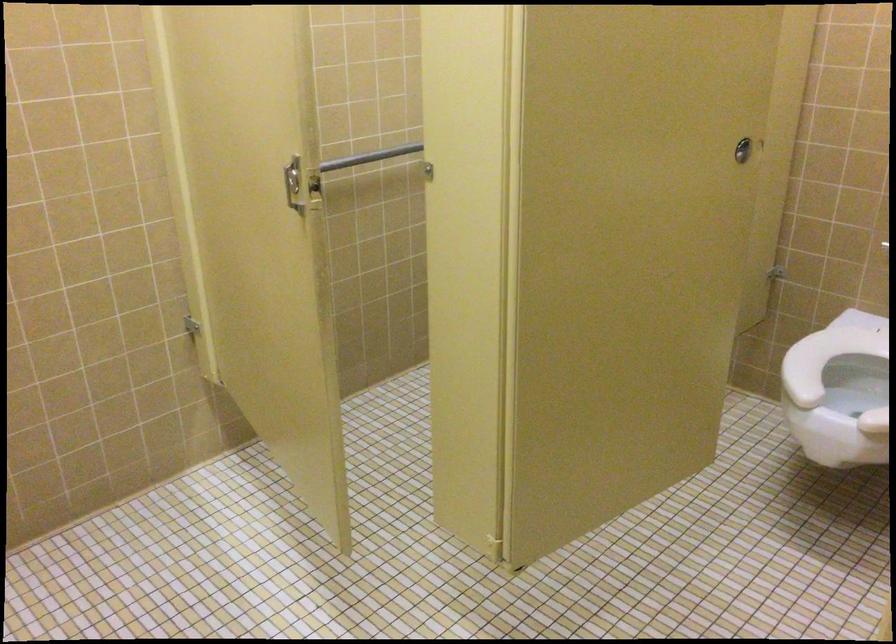
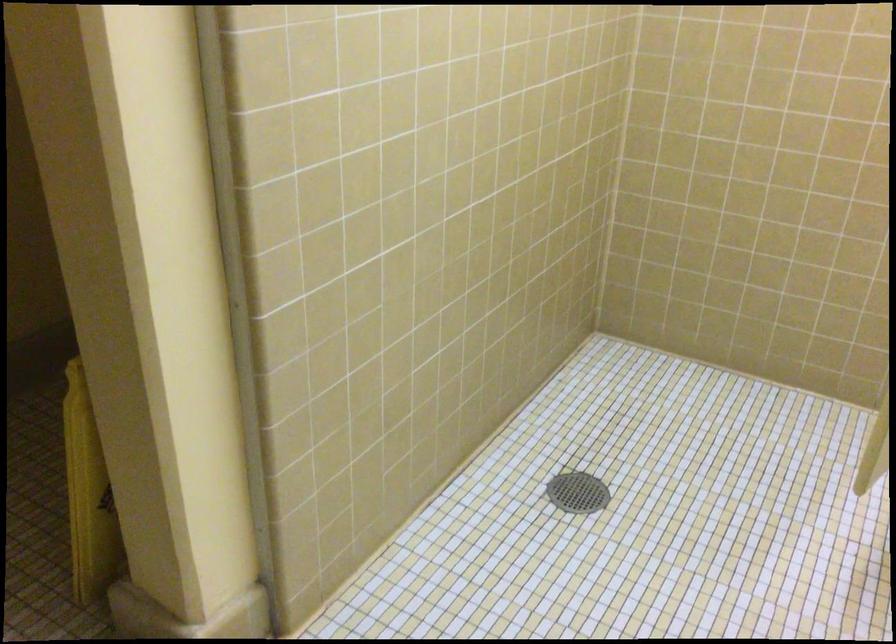
First-person continuous shooting, in which direction is the camera rotating?

The camera rotated toward left-down.